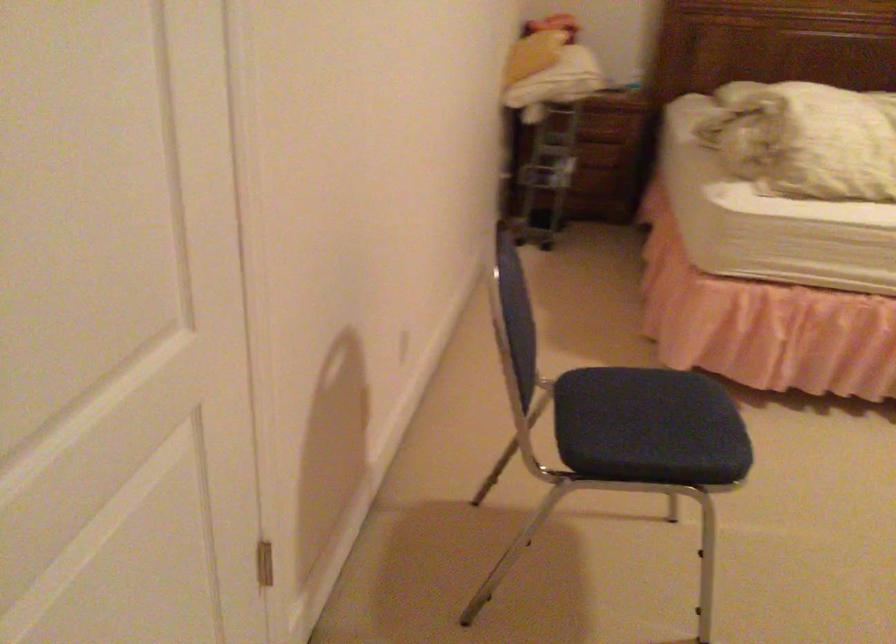
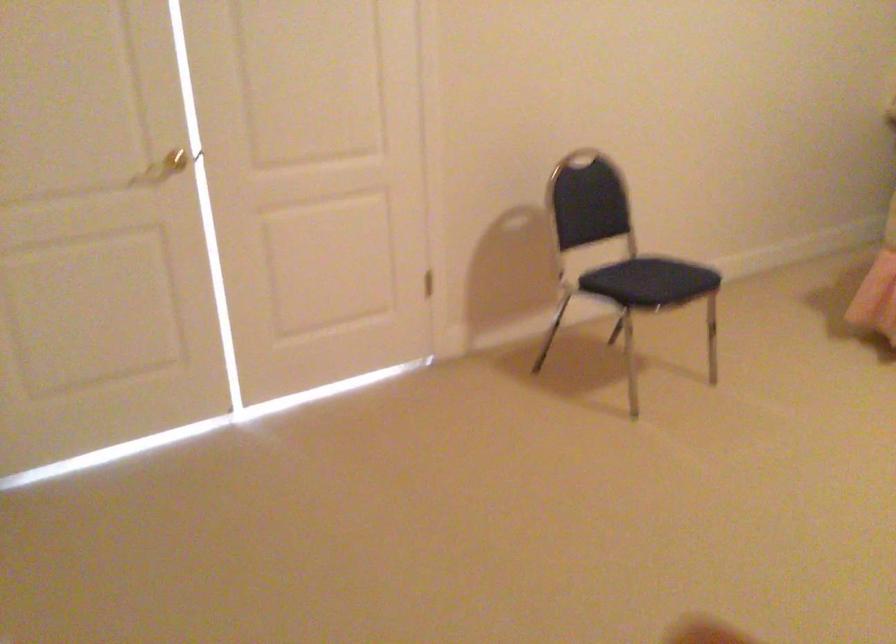
In the second image, find the point that corresponds to (x=678, y=415) in the first image.

(657, 276)